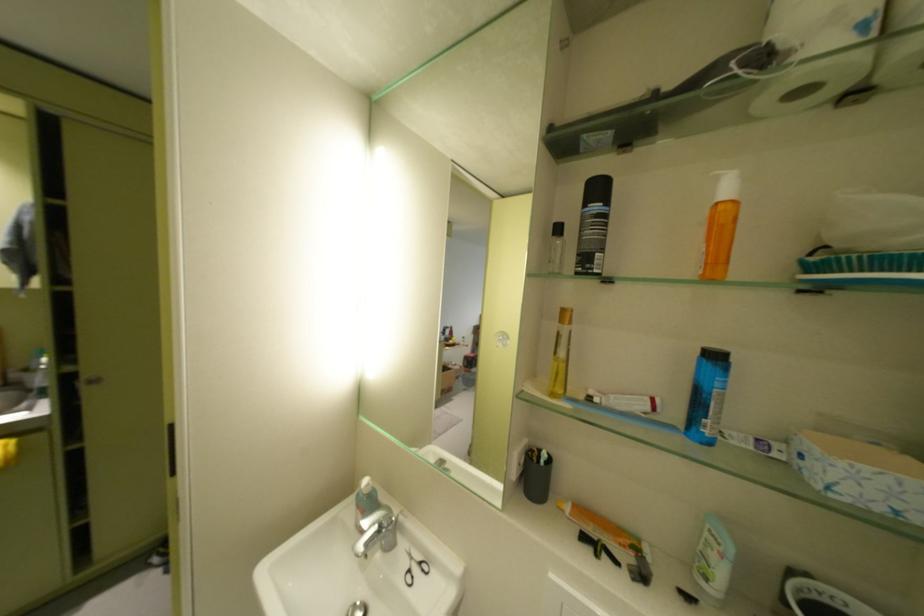
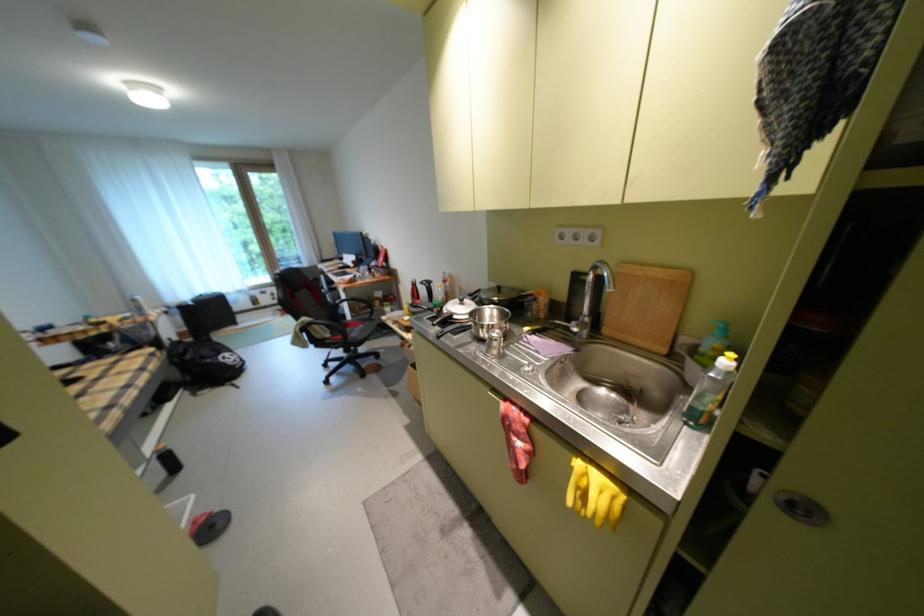
In the second image, find the point that corresponds to the point at 103,383 in the first image.

(811, 511)